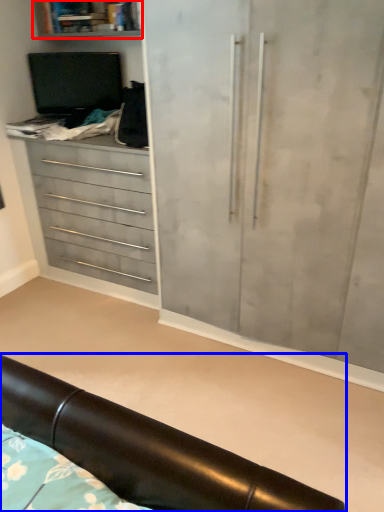
Question: Which of the following is the closest to the observer, shelf (highlighted by a red box) or furniture (highlighted by a blue box)?

Choices:
 (A) shelf
 (B) furniture

Answer: (B)